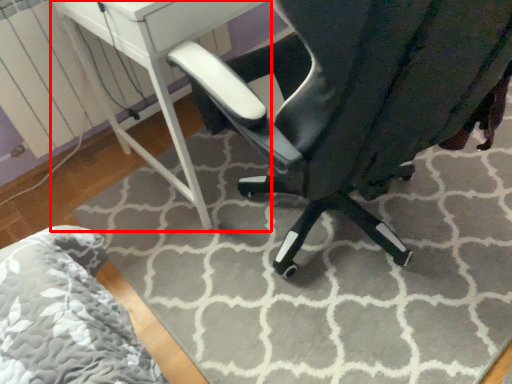
Question: From the image's perspective, what is the correct spatial positioning of table (annotated by the red box) in reference to chair?

Choices:
 (A) above
 (B) below

Answer: (A)